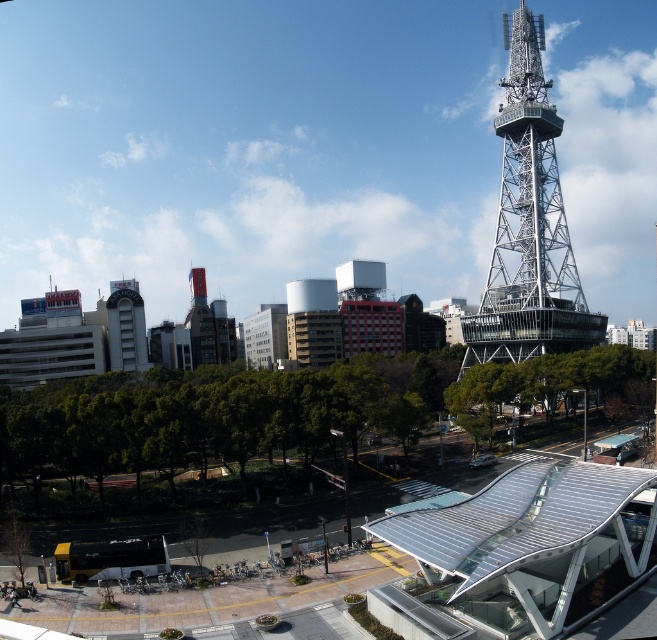
Question: Which point is closer to the camera?

Choices:
 (A) (464, 365)
 (B) (133, 330)

Answer: (A)

Question: Can you confirm if metallic lattice tower at upper right is positioned to the left of white concrete building at left?

Choices:
 (A) no
 (B) yes

Answer: (A)

Question: Is metallic lattice tower at upper right behind white concrete building at left?

Choices:
 (A) no
 (B) yes

Answer: (A)

Question: Is metallic lattice tower at upper right positioned in front of white concrete building at left?

Choices:
 (A) yes
 (B) no

Answer: (A)